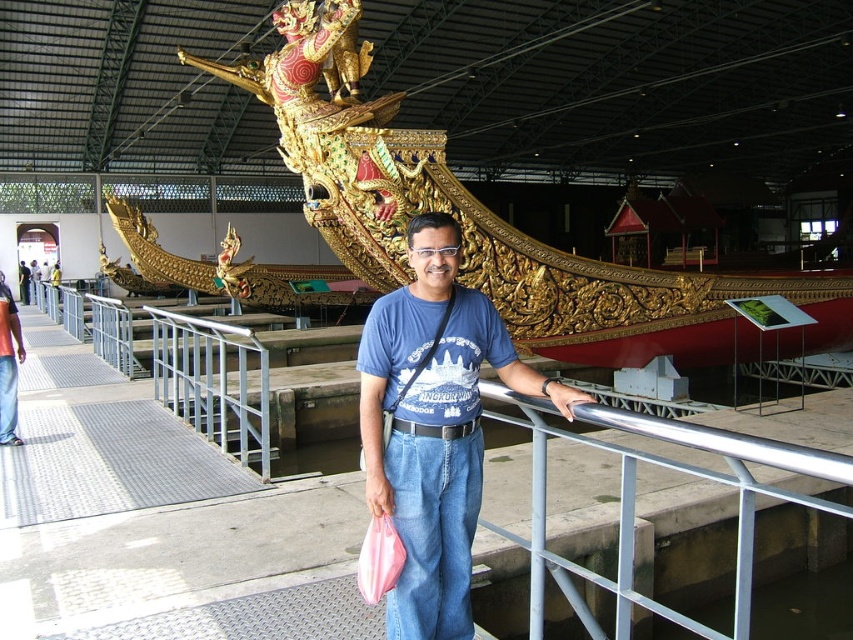
Does gold/gilded wood boat at center have a larger size compared to blue cotton t-shirt at center?

Indeed, gold/gilded wood boat at center has a larger size compared to blue cotton t-shirt at center.

Consider the image. Does gold/gilded wood boat at center appear over blue cotton t-shirt at center?

Yes, gold/gilded wood boat at center is above blue cotton t-shirt at center.

Which is behind, point (354, 200) or point (401, 305)?

Point (354, 200)

Identify the location of gold/gilded wood boat at center. This screenshot has height=640, width=853. (480, 218).

Based on the photo, is metal/rail at center positioned before gold/gilded wood boat at center?

Yes, metal/rail at center is in front of gold/gilded wood boat at center.

Between point (113, 600) and point (467, 228), which one is positioned behind?

Point (467, 228)

Does point (614, 584) come farther from viewer compared to point (404, 93)?

No, it is not.

This screenshot has height=640, width=853. I want to click on metal/rail at center, so click(x=164, y=522).

Where is `metal/rail at center`? metal/rail at center is located at coordinates (164, 522).

Can you confirm if metal/rail at center is smaller than blue cotton t-shirt at center?

Actually, metal/rail at center might be larger than blue cotton t-shirt at center.

Where is `metal/rail at center`? This screenshot has height=640, width=853. metal/rail at center is located at coordinates (164, 522).